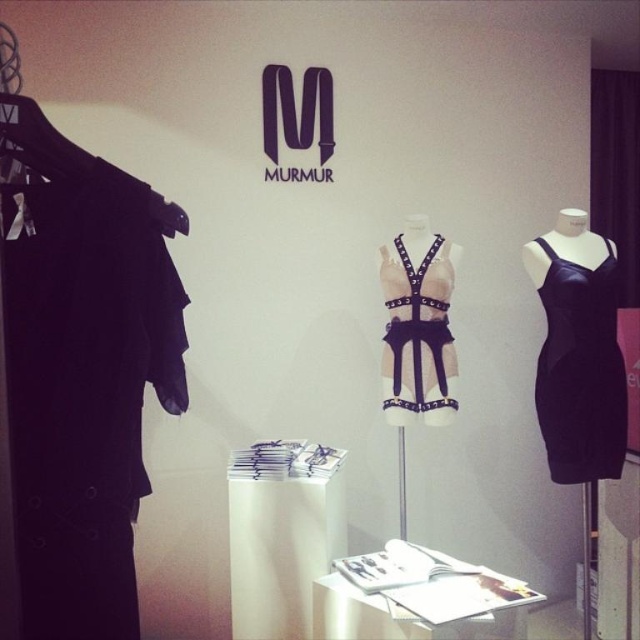
Is satin black dress at right smaller than leather harness at center?

Actually, satin black dress at right might be larger than leather harness at center.

Who is higher up, satin black dress at right or leather harness at center?

leather harness at center

Which is behind, point (604, 435) or point (429, 380)?

The point (429, 380) is more distant.

Find the location of `satin black dress at right`. satin black dress at right is located at coordinates (580, 371).